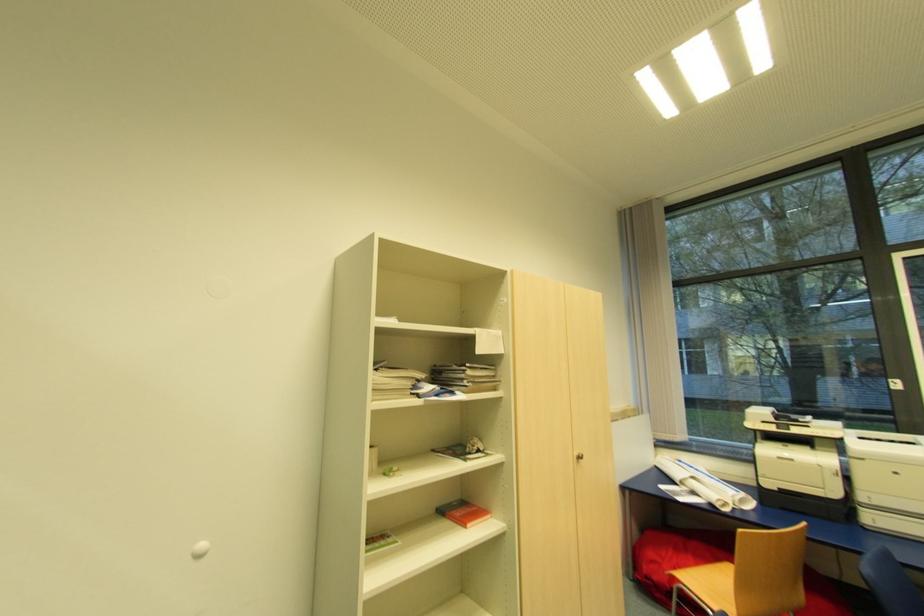
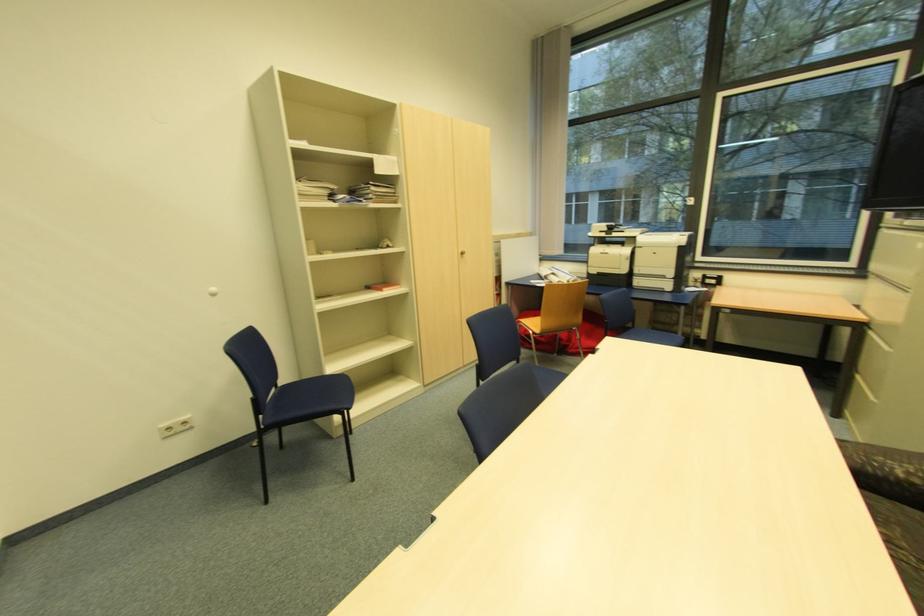
Question: How did the camera likely rotate?

Choices:
 (A) Left
 (B) Right
 (C) Up
 (D) Down

Answer: (D)